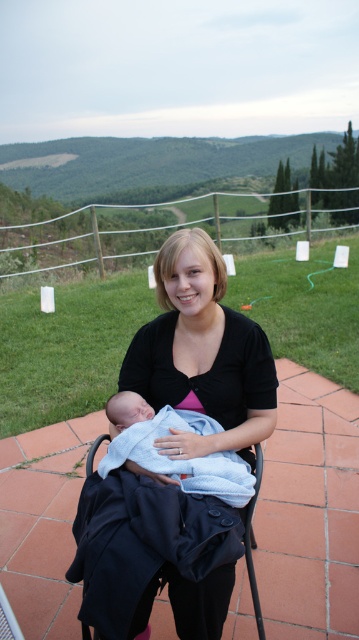
Question: Is black fabric at center bigger than black fabric folding chair at center?

Choices:
 (A) yes
 (B) no

Answer: (A)

Question: Which object appears closest to the camera in this image?

Choices:
 (A) blue cotton blanket at center
 (B) black fabric at center

Answer: (B)

Question: Where is black fabric at center located in relation to black fabric folding chair at center in the image?

Choices:
 (A) right
 (B) left

Answer: (A)

Question: Is black fabric at center positioned at the back of blue cotton blanket at center?

Choices:
 (A) no
 (B) yes

Answer: (A)

Question: Which object appears closest to the camera in this image?

Choices:
 (A) blue cotton blanket at center
 (B) black fabric at center
 (C) black fabric folding chair at center

Answer: (C)

Question: Which point appears farthest from the camera in this image?

Choices:
 (A) (127, 566)
 (B) (222, 461)

Answer: (B)